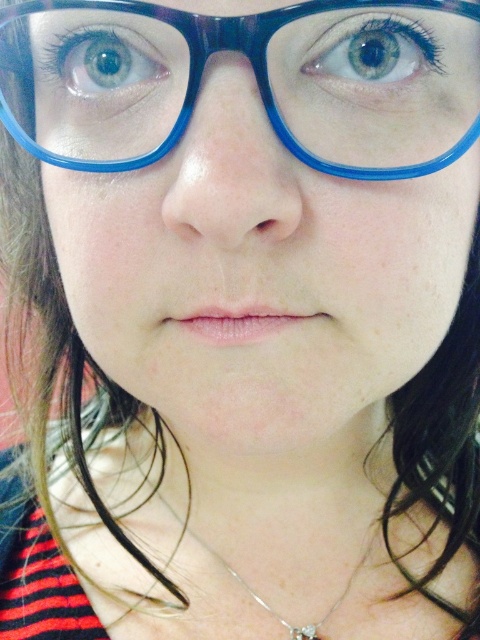
You are a photographer holding a camera that has a lens with a focal length of 50mm. You are currently positioned at a distance of 10.48 inches away from the point marked at coordinates point (280, 44). Based on the scene description, can you determine if the entire face of the person in the portrait will fit within the camera frame?

The point (280, 44) is 10.48 inches away from the viewer. Since the person is in a closeup portrait with their face occupying most of the frame, the entire face will likely fit within the camera frame at this distance with a 50mm lens.

You are a photographer adjusting the camera focus. The subject has blue plastic glasses at upper center and a silver metallic necklace at center. Which object is closer to the camera lens? Please explain your reasoning based on their positions in the image.

The blue plastic glasses at upper center is closer to the camera lens than the silver metallic necklace at center because objects that appear larger in the frame are typically closer to the viewer. Since the glasses are at upper center and the necklace is at center, the glasses occupy more space in the image, indicating proximity. Additionally, the description states they are 12.34 inches apart, but without knowing the camera lens specifications, we can infer spatial positioning from their placement in the